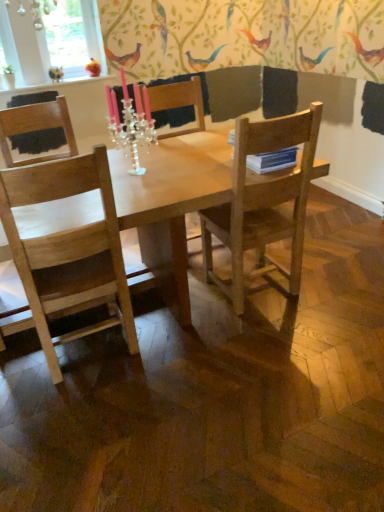
Question: Could you tell me if light brown wooden table at center is facing matte black bird at upper left, the second bird in the right-to-left sequence?

Choices:
 (A) yes
 (B) no

Answer: (B)

Question: Considering the relative positions of light brown wooden table at center and matte black bird at upper left, marked as the first bird in a left-to-right arrangement, in the image provided, is light brown wooden table at center to the left of matte black bird at upper left, marked as the first bird in a left-to-right arrangement, from the viewer's perspective?

Choices:
 (A) no
 (B) yes

Answer: (A)

Question: Does light brown wooden table at center have a lesser height compared to matte black bird at upper left, the second bird in the right-to-left sequence?

Choices:
 (A) no
 (B) yes

Answer: (A)

Question: Is light brown wooden table at center taller than matte black bird at upper left, the second bird in the right-to-left sequence?

Choices:
 (A) yes
 (B) no

Answer: (A)

Question: Does light brown wooden table at center appear on the right side of matte black bird at upper left, marked as the first bird in a left-to-right arrangement?

Choices:
 (A) no
 (B) yes

Answer: (B)

Question: Is light brown wooden table at center far from matte black bird at upper left, marked as the first bird in a left-to-right arrangement?

Choices:
 (A) no
 (B) yes

Answer: (B)

Question: Is light brown wooden table at center smaller than wooden chair at right, marked as the 2th chair in a left-to-right arrangement?

Choices:
 (A) yes
 (B) no

Answer: (B)

Question: From a real-world perspective, is light brown wooden table at center physically below wooden chair at right, marked as the 2th chair in a left-to-right arrangement?

Choices:
 (A) yes
 (B) no

Answer: (A)

Question: Is the position of light brown wooden table at center less distant than that of wooden chair at right, marked as the 2th chair in a left-to-right arrangement?

Choices:
 (A) yes
 (B) no

Answer: (A)

Question: Does light brown wooden table at center appear on the left side of wooden chair at right, marked as the 2th chair in a left-to-right arrangement?

Choices:
 (A) yes
 (B) no

Answer: (A)

Question: Is light brown wooden table at center positioned with its back to wooden chair at right, marked as the 2th chair in a left-to-right arrangement?

Choices:
 (A) no
 (B) yes

Answer: (A)

Question: Is wooden chair at right, marked as the 2th chair in a left-to-right arrangement, located within light brown wooden table at center?

Choices:
 (A) yes
 (B) no

Answer: (A)

Question: Is wooden chair at center next to matte orange bird at upper left, arranged as the first bird when viewed from the right?

Choices:
 (A) yes
 (B) no

Answer: (B)